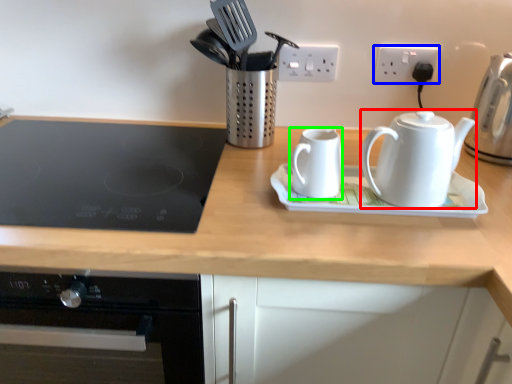
Question: Which object is positioned closest to kettle (highlighted by a red box)? Select from electric outlet (highlighted by a blue box) and kettle (highlighted by a green box).

Choices:
 (A) electric outlet
 (B) kettle

Answer: (B)